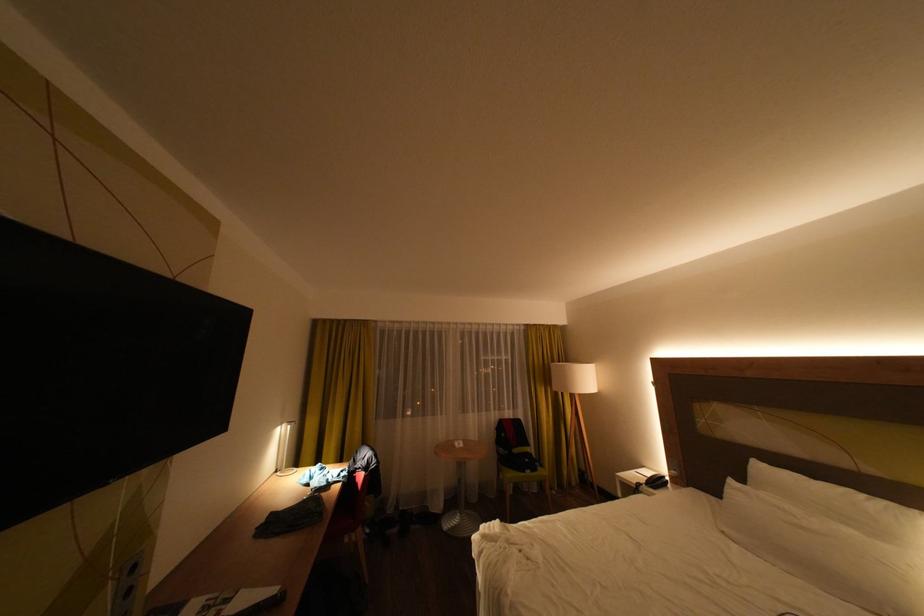
The height and width of the screenshot is (616, 924). Identify the location of telephone handset. (x=657, y=480).